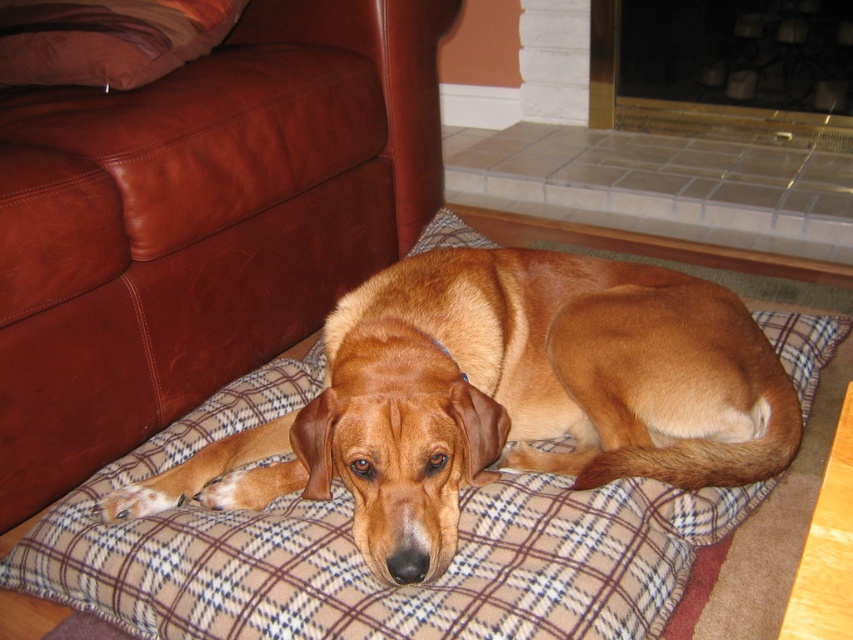
Question: Which object is farther from the camera taking this photo?

Choices:
 (A) brown leather pillow at upper left
 (B) shiny brown dog at center
 (C) brown leather couch at left

Answer: (A)

Question: Considering the relative positions of brown leather couch at left and shiny brown dog at center in the image provided, where is brown leather couch at left located with respect to shiny brown dog at center?

Choices:
 (A) above
 (B) below

Answer: (A)

Question: In this image, where is brown leather couch at left located relative to brown leather pillow at upper left?

Choices:
 (A) right
 (B) left

Answer: (A)

Question: Does brown leather couch at left appear on the right side of shiny brown dog at center?

Choices:
 (A) yes
 (B) no

Answer: (B)

Question: Which object appears closest to the camera in this image?

Choices:
 (A) brown leather couch at left
 (B) shiny brown dog at center

Answer: (B)

Question: Among these points, which one is nearest to the camera?

Choices:
 (A) (190, 26)
 (B) (119, 198)

Answer: (B)